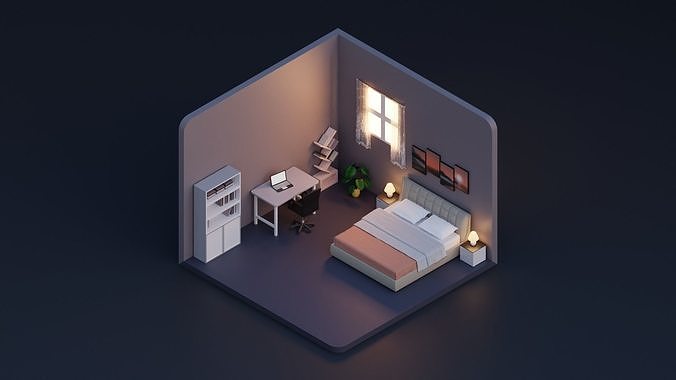
Where is `curtain`? The width and height of the screenshot is (676, 380). curtain is located at coordinates (397, 138).